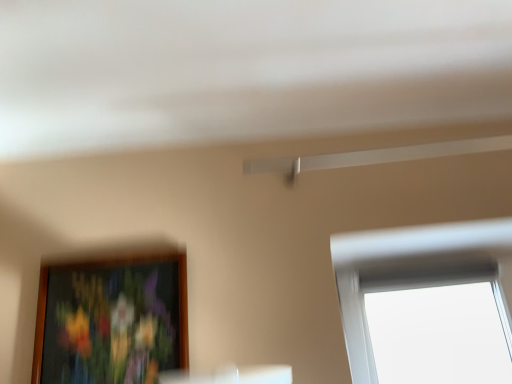
Question: Should I look upward or downward to see wooden picture frame at lower left?

Choices:
 (A) up
 (B) down

Answer: (B)